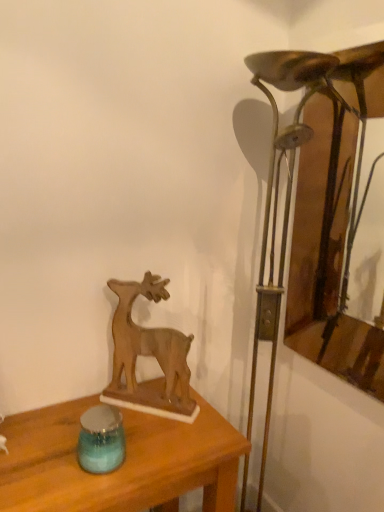
Question: From their relative heights in the image, would you say wooden deer at center is taller or shorter than blue glass candle holder at lower left?

Choices:
 (A) tall
 (B) short

Answer: (A)

Question: Relative to blue glass candle holder at lower left, is wooden deer at center in front or behind?

Choices:
 (A) front
 (B) behind

Answer: (B)

Question: Based on their relative distances, which object is farther from the bronze metallic table lamp at right?

Choices:
 (A) wooden table at center
 (B) wooden deer at center
 (C) wooden frame at right
 (D) blue glass candle holder at lower left

Answer: (D)

Question: Estimate the real-world distances between objects in this image. Which object is farther from the bronze metallic table lamp at right?

Choices:
 (A) blue glass candle holder at lower left
 (B) wooden frame at right
 (C) wooden deer at center
 (D) wooden table at center

Answer: (A)